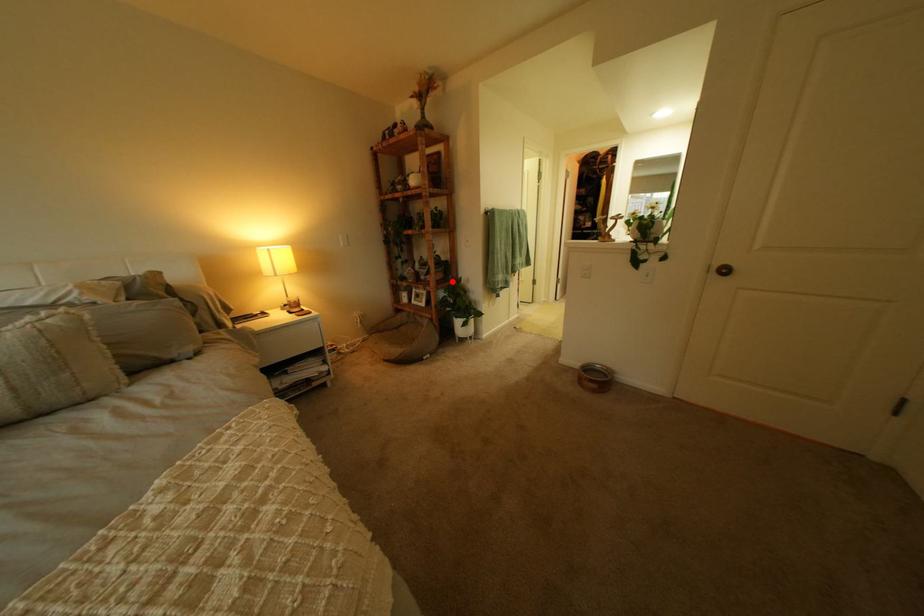
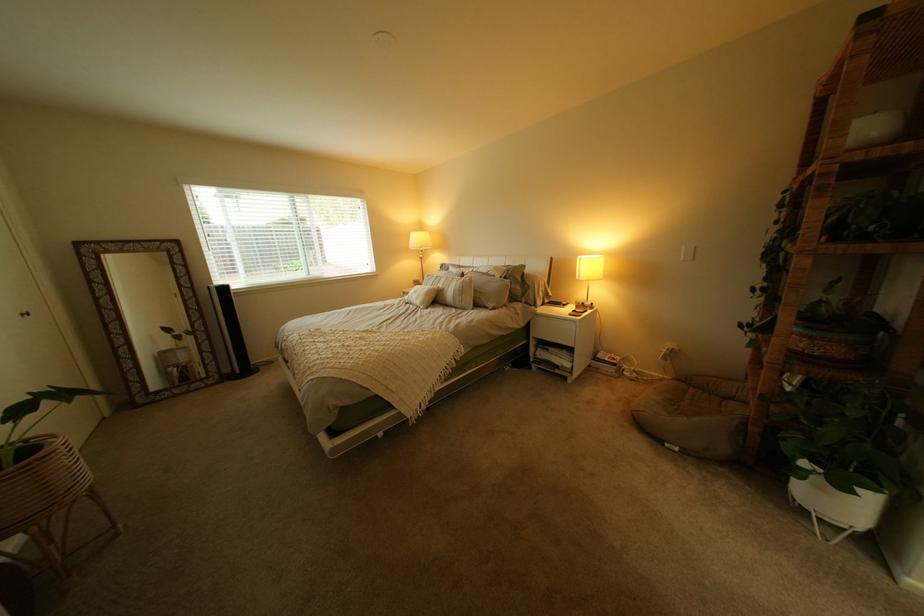
Where in the second image is the point corresponding to the highlighted location from the first image?

(805, 354)